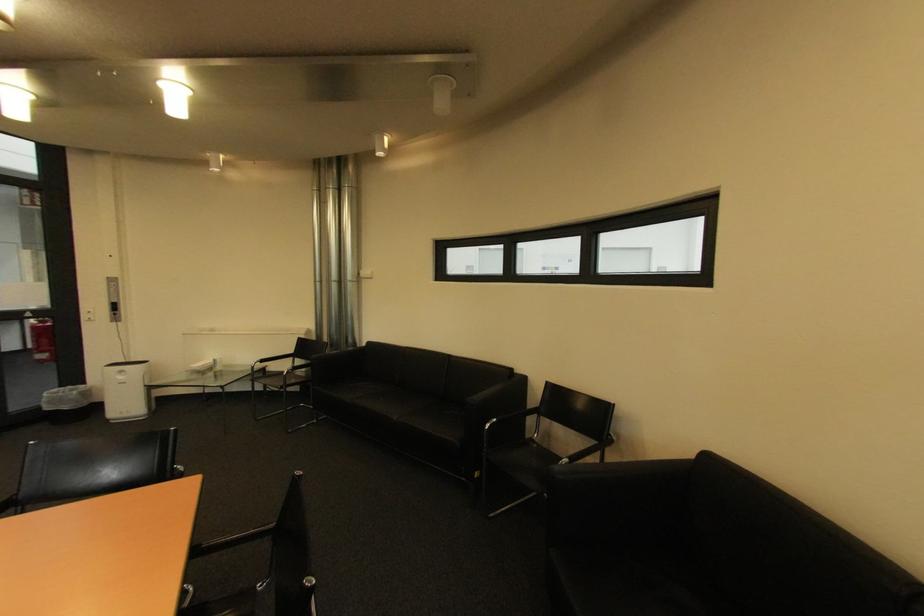
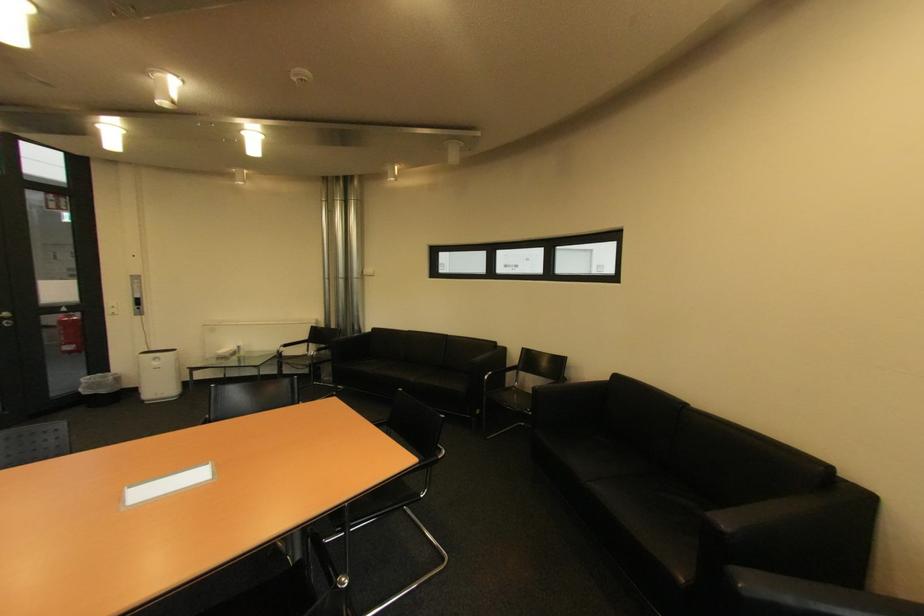
Where in the second image is the point corresponding to point 51,358 from the first image?

(79, 349)